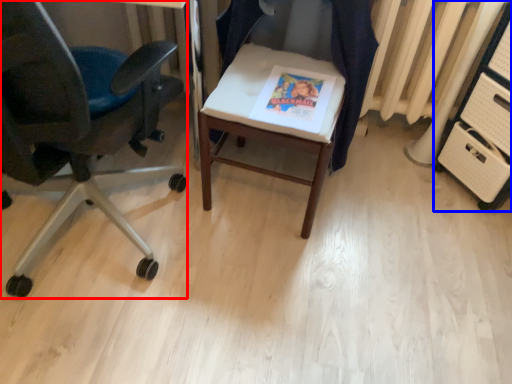
Question: Which point is further to the camera, chair (highlighted by a red box) or file cabinet (highlighted by a blue box)?

Choices:
 (A) chair
 (B) file cabinet

Answer: (B)